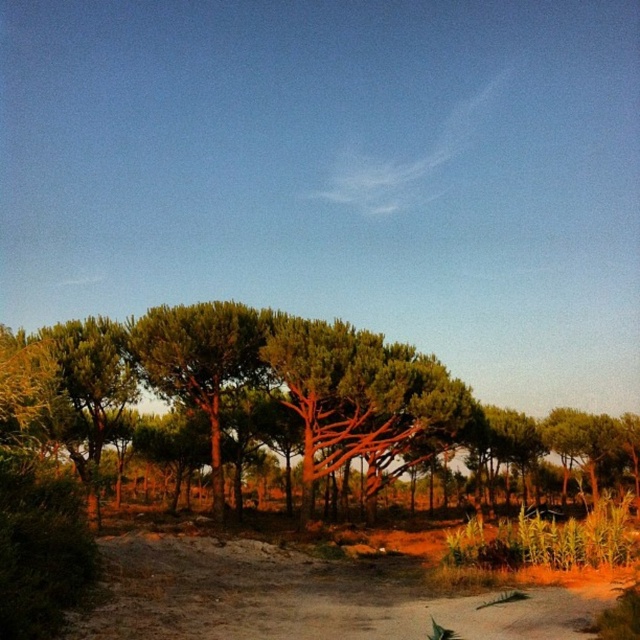
Based on the photo, does green leafy tree at left have a greater width compared to brown sandy dirt track at lower center?

Correct, the width of green leafy tree at left exceeds that of brown sandy dirt track at lower center.

Is point (497, 445) closer to viewer compared to point (218, 614)?

No, it is behind (218, 614).

Is point (99, 358) positioned before point (280, 548)?

No, (99, 358) is behind (280, 548).

The width and height of the screenshot is (640, 640). Identify the location of green leafy tree at left. (301, 392).